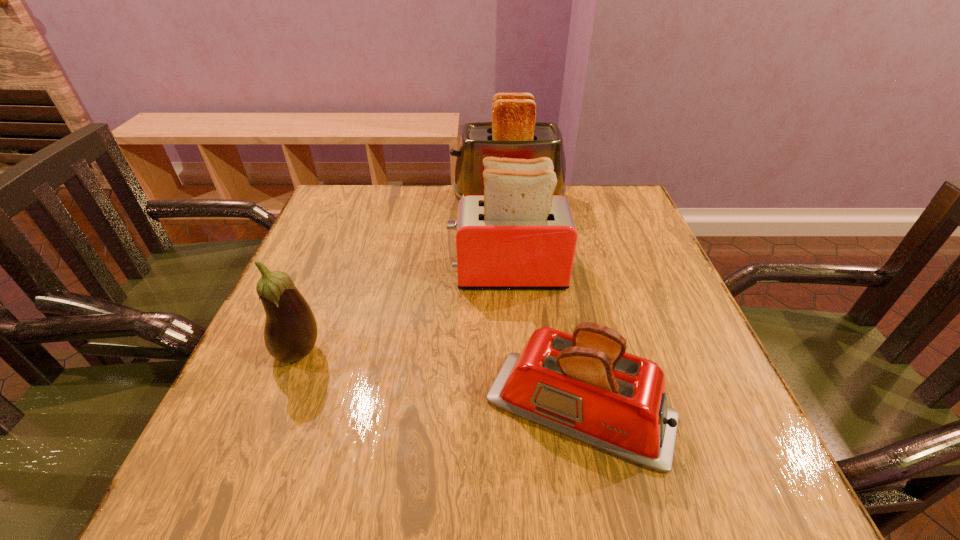
This screenshot has width=960, height=540. Identify the location of vacant space at the left edge of the desktop. (338, 337).

Where is `vacant space at the right edge`? The height and width of the screenshot is (540, 960). vacant space at the right edge is located at coordinates (638, 330).

At what (x,y) coordinates should I click in order to perform the action: click on blank space at the far right corner of the desktop. Please return your answer as a coordinate pair (x, y). Image resolution: width=960 pixels, height=540 pixels. Looking at the image, I should click on (615, 212).

Identify the location of free space at the near right corner. (725, 469).

The height and width of the screenshot is (540, 960). I want to click on vacant point located between the second farthest object and the eggplant, so [x=403, y=313].

The height and width of the screenshot is (540, 960). In order to click on free space between the eggplant and the shortest toaster in this screenshot , I will do `click(440, 381)`.

Find the location of a particular element. Image resolution: width=960 pixels, height=540 pixels. free spot between the second farthest toaster and the third tallest object is located at coordinates (403, 313).

Find the location of a particular element. This screenshot has width=960, height=540. unoccupied area between the third nearest object and the leftmost object is located at coordinates (403, 313).

The height and width of the screenshot is (540, 960). What are the coordinates of `free space between the second shortest object and the farthest object` in the screenshot? It's located at (403, 277).

At what (x,y) coordinates should I click in order to perform the action: click on free point between the nearest toaster and the farthest object. Please return your answer as a coordinate pair (x, y). Looking at the image, I should click on (544, 305).